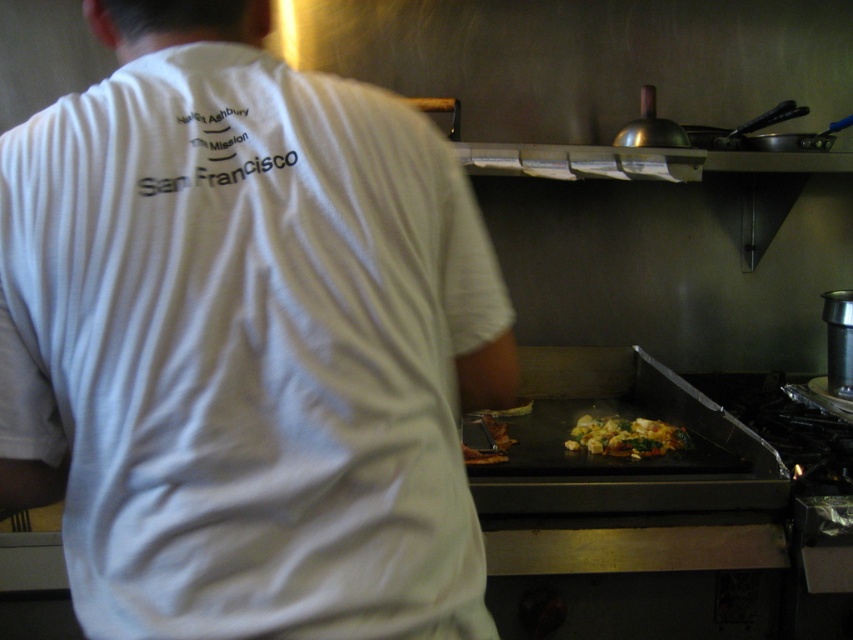
You are a health inspector observing a commercial kitchen. You notice the white cotton shirt at center and the green leafy vegetables at center. According to health and safety regulations, which item should be kept away from the cooking area to prevent contamination?

The white cotton shirt at center should be kept away from the cooking area to prevent contamination, as clothing can carry bacteria and contaminate food items like the green leafy vegetables at center.

Looking at the person in the commercial kitchen, which object is bigger between the white cotton shirt at center and the white fabric text at upper center?

The white cotton shirt at center is larger in size compared to the white fabric text at upper center.